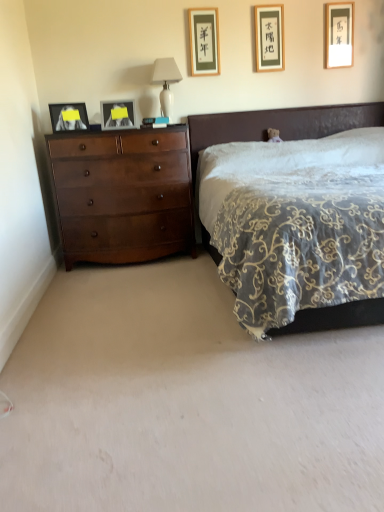
Question: Considering the positions of black paper picture frame at upper center, the third picture frame from the left, and matte gold picture frame at upper right, which ranks as the first picture frame in right-to-left order, in the image, is black paper picture frame at upper center, the third picture frame from the left, wider or thinner than matte gold picture frame at upper right, which ranks as the first picture frame in right-to-left order,?

Choices:
 (A) wide
 (B) thin

Answer: (A)

Question: From the image's perspective, is black paper picture frame at upper center, the 3th picture frame viewed from the right, above or below matte gold picture frame at upper right, acting as the 5th picture frame starting from the left?

Choices:
 (A) above
 (B) below

Answer: (B)

Question: Which object is the closest to the velvet dark brown bed at center?

Choices:
 (A) white glossy table lamp at upper center
 (B) black paper picture frame at upper center, the 3th picture frame viewed from the right
 (C) matte wooden picture frame at upper center, placed as the fourth picture frame when sorted from left to right
 (D) matte gold picture frame at upper right, acting as the 5th picture frame starting from the left
 (E) shiny brown dresser at left

Answer: (A)

Question: Which is farther from the shiny brown dresser at left?

Choices:
 (A) matte black picture frame at left, the 5th picture frame in the right-to-left sequence
 (B) white glossy table lamp at upper center
 (C) velvet dark brown bed at center
 (D) matte gold picture frame at upper right, acting as the 5th picture frame starting from the left
 (E) matte wooden picture frame at upper center, placed as the fourth picture frame when sorted from left to right

Answer: (D)